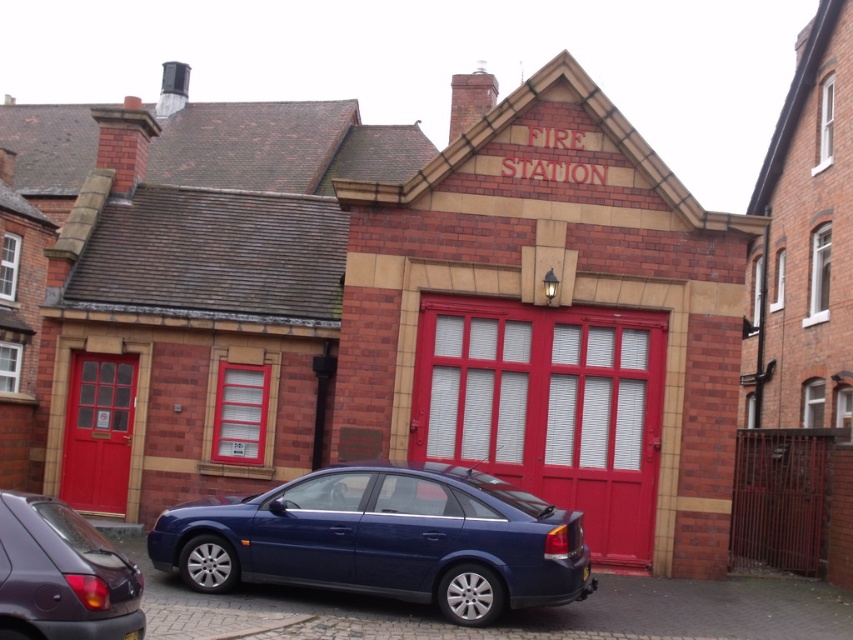
Image resolution: width=853 pixels, height=640 pixels. I want to click on smooth glossy red garage door at center, so click(548, 406).

How distant is smooth glossy red garage door at center from matte purple car at lower left?

smooth glossy red garage door at center and matte purple car at lower left are 7.41 meters apart.

Locate an element on the screen. Image resolution: width=853 pixels, height=640 pixels. smooth glossy red garage door at center is located at coordinates (548, 406).

Which of these two, smooth glossy red garage door at center or matte red door at left, stands taller?

With more height is smooth glossy red garage door at center.

This screenshot has height=640, width=853. Identify the location of smooth glossy red garage door at center. (548, 406).

Can you confirm if matte purple car at lower left is shorter than matte red door at left?

Yes, matte purple car at lower left is shorter than matte red door at left.

Which is in front, point (65, 580) or point (126, 432)?

Positioned in front is point (65, 580).

Between point (50, 563) and point (77, 419), which one is positioned behind?

Point (77, 419)

Identify the location of matte purple car at lower left. Image resolution: width=853 pixels, height=640 pixels. (62, 576).